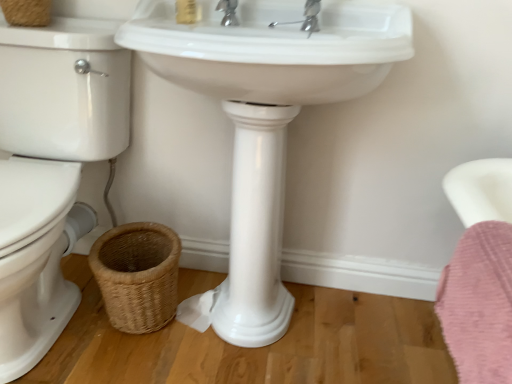
Where is `spots to the right of woven natural basket at lower left, the second basket positioned from the top`? The image size is (512, 384). spots to the right of woven natural basket at lower left, the second basket positioned from the top is located at coordinates (210, 342).